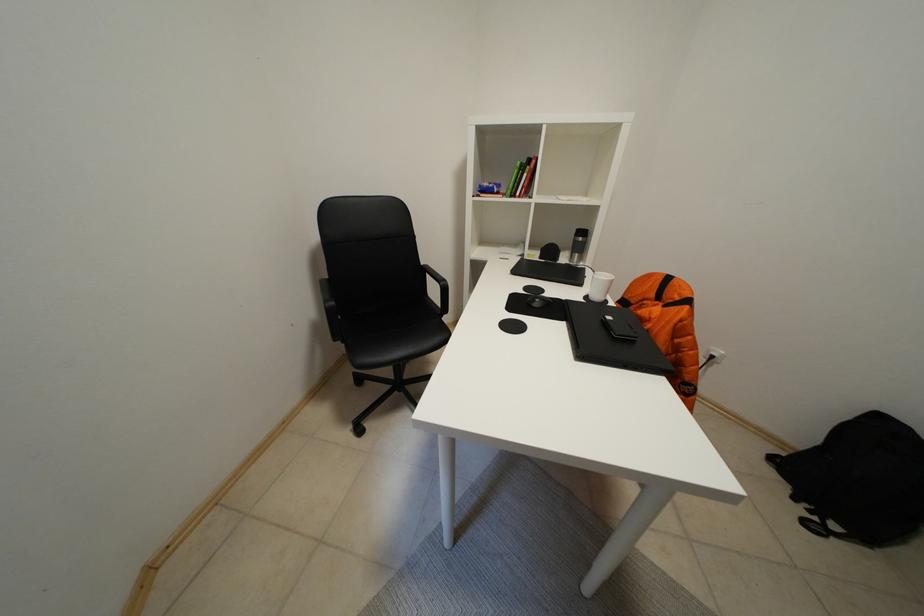
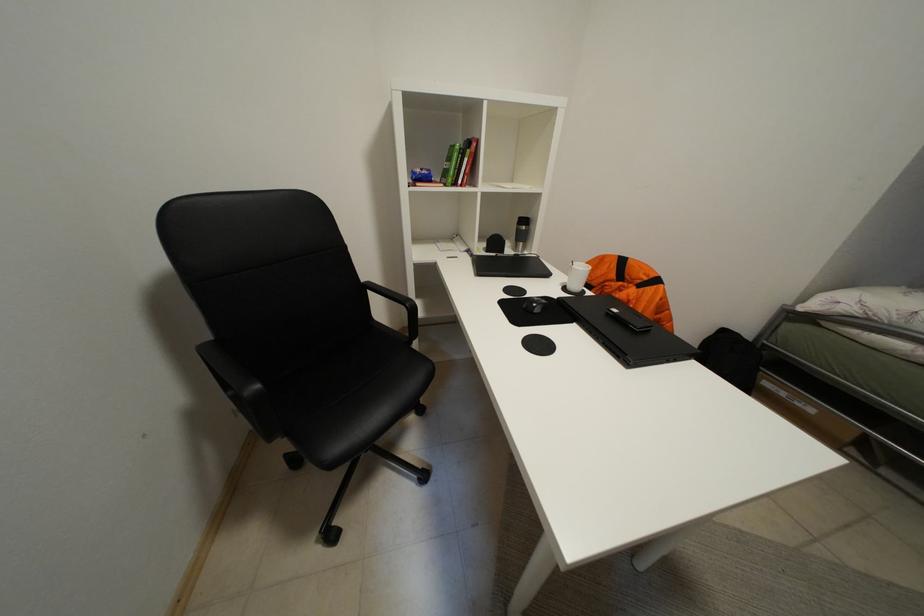
Question: How did the camera likely rotate?

Choices:
 (A) Left
 (B) Right
 (C) Up
 (D) Down

Answer: (B)